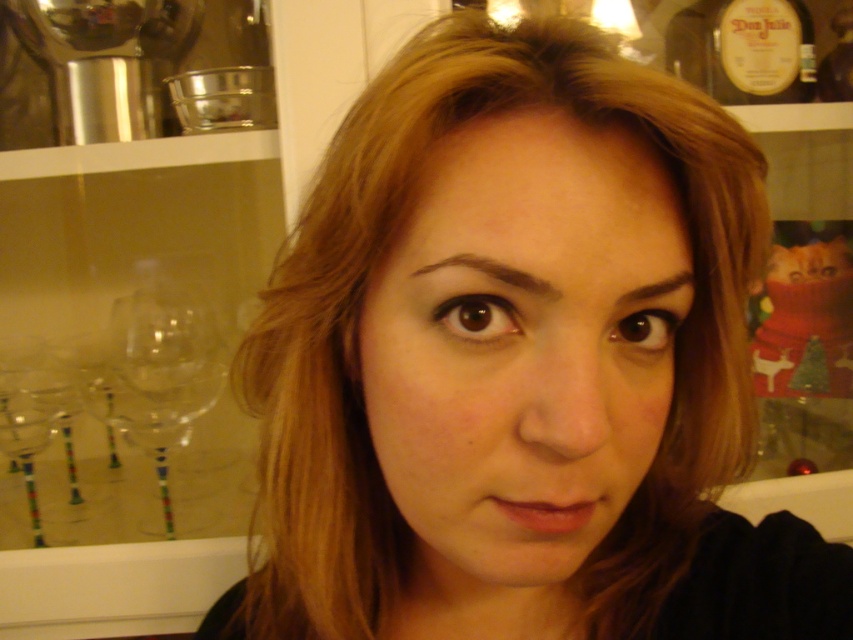
Is transparent glass wine glass at left shorter than matte glass bottle at upper right?

Incorrect, transparent glass wine glass at left's height does not fall short of matte glass bottle at upper right's.

Which is behind, point (131, 381) or point (743, 6)?

Point (131, 381)

Where is `transparent glass wine glass at left`? transparent glass wine glass at left is located at coordinates (161, 372).